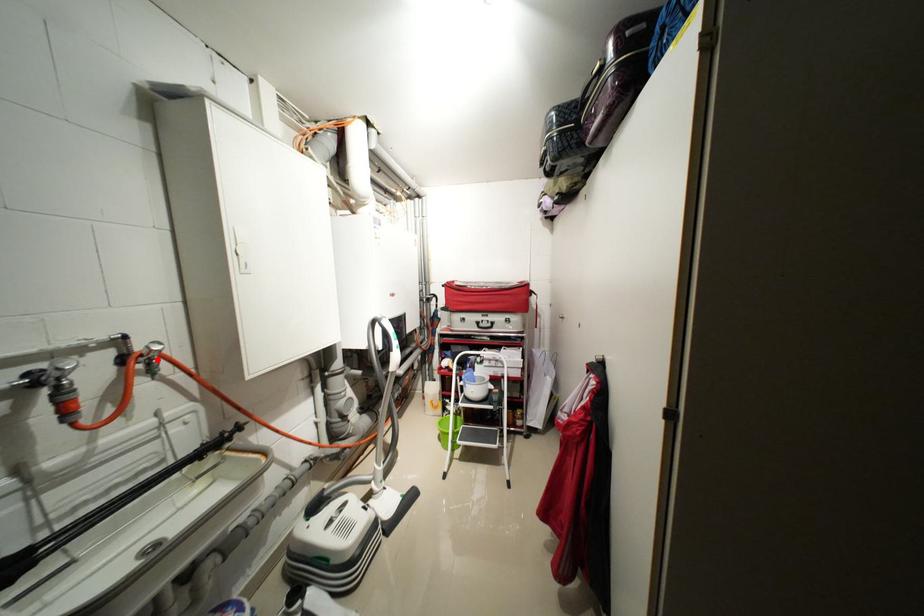
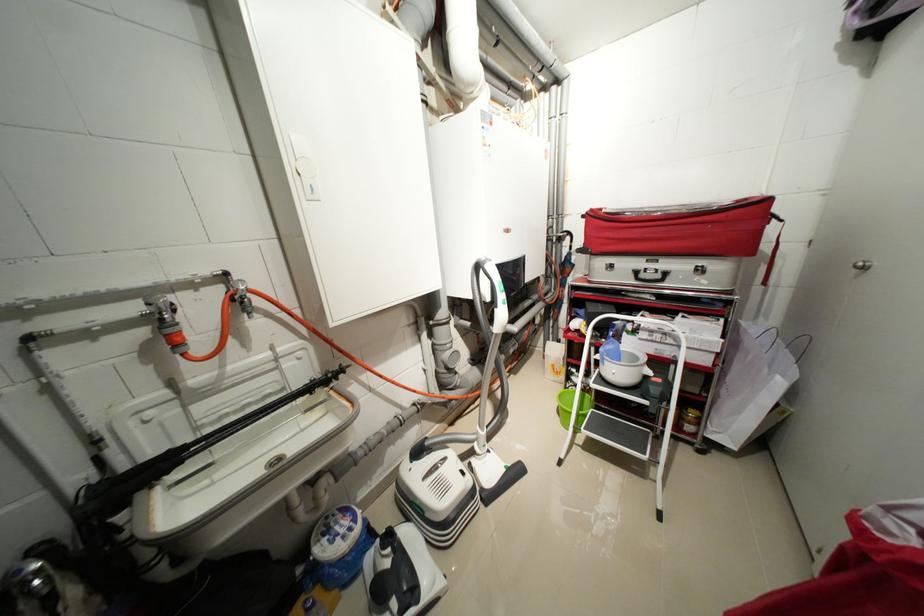
Locate, in the second image, the point that corresponds to the highlighted location in the first image.

(249, 299)